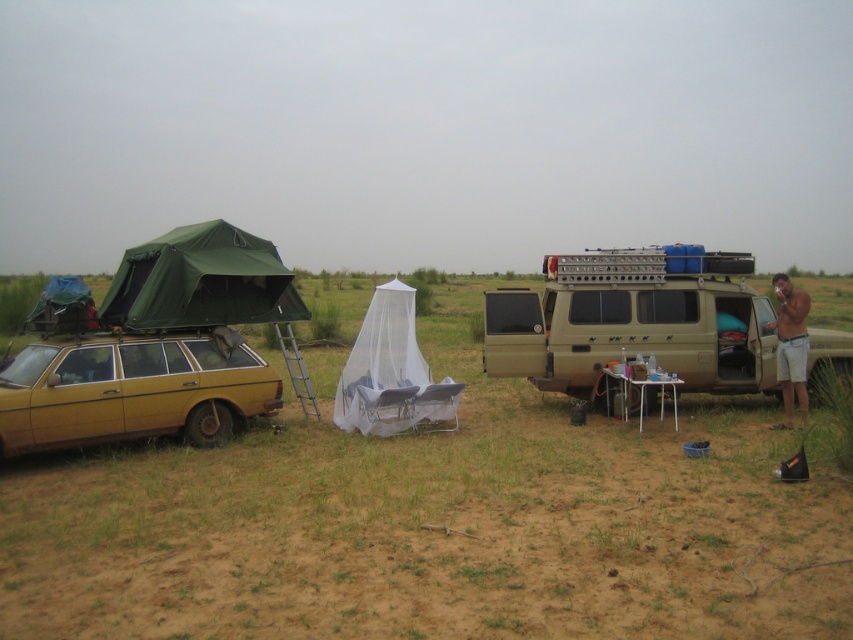
Question: Does matte black tent at left appear on the left side of brown textured shorts at right?

Choices:
 (A) yes
 (B) no

Answer: (A)

Question: Is matte black tent at left behind matte gold van at center?

Choices:
 (A) no
 (B) yes

Answer: (A)

Question: Which of the following is the farthest from the observer?

Choices:
 (A) (259, 260)
 (B) (223, 348)
 (C) (4, 364)
 (D) (662, 330)

Answer: (D)

Question: Which is farther from the brown textured shorts at right?

Choices:
 (A) matte black tent at left
 (B) matte gold van at center
 (C) yellow matte station wagon at left

Answer: (C)

Question: Which of the following is the closest to the observer?

Choices:
 (A) yellow matte station wagon at left
 (B) matte gold van at center
 (C) brown textured shorts at right
 (D) matte black tent at left

Answer: (A)

Question: Can you confirm if green fabric tent at upper left is thinner than brown textured shorts at right?

Choices:
 (A) no
 (B) yes

Answer: (B)